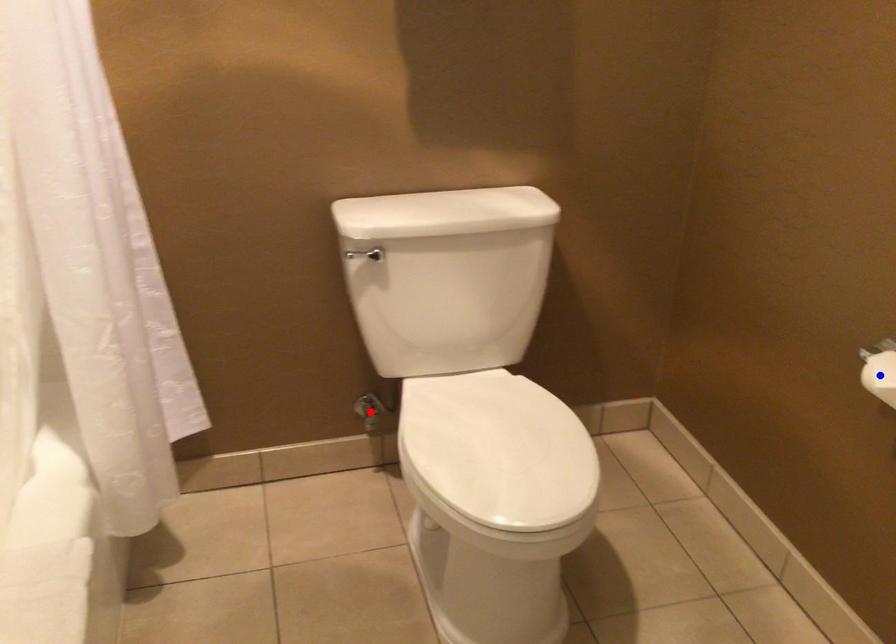
Question: In the image, two points are highlighted. Which point is nearer to the camera? Reply with the corresponding letter.

Choices:
 (A) blue point
 (B) red point

Answer: (A)